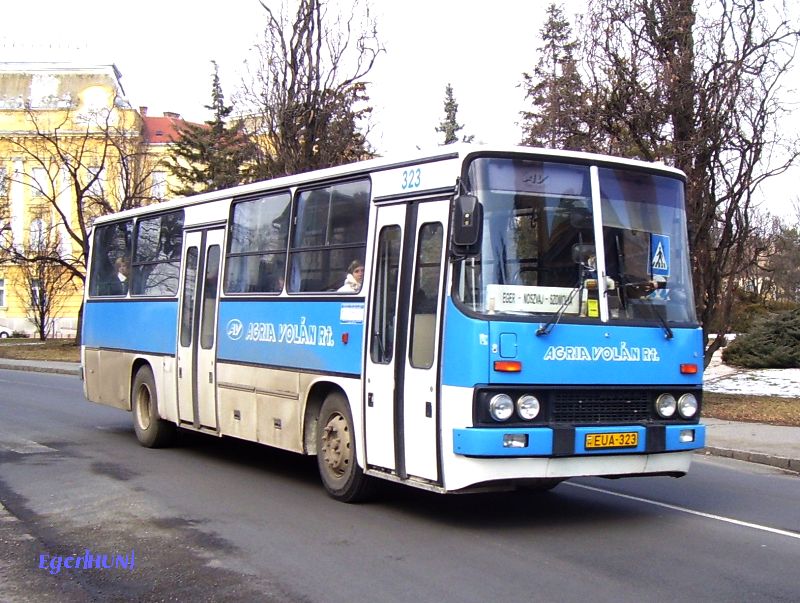
You are a GUI agent. You are given a task and a screenshot of the screen. Output one action in this format:
    pyautogui.click(x=<x>, y=<y>)
    Task: Click on the windows
    The height and width of the screenshot is (603, 800).
    Given the screenshot: What is the action you would take?
    pyautogui.click(x=98, y=250), pyautogui.click(x=146, y=251), pyautogui.click(x=257, y=239), pyautogui.click(x=312, y=232)